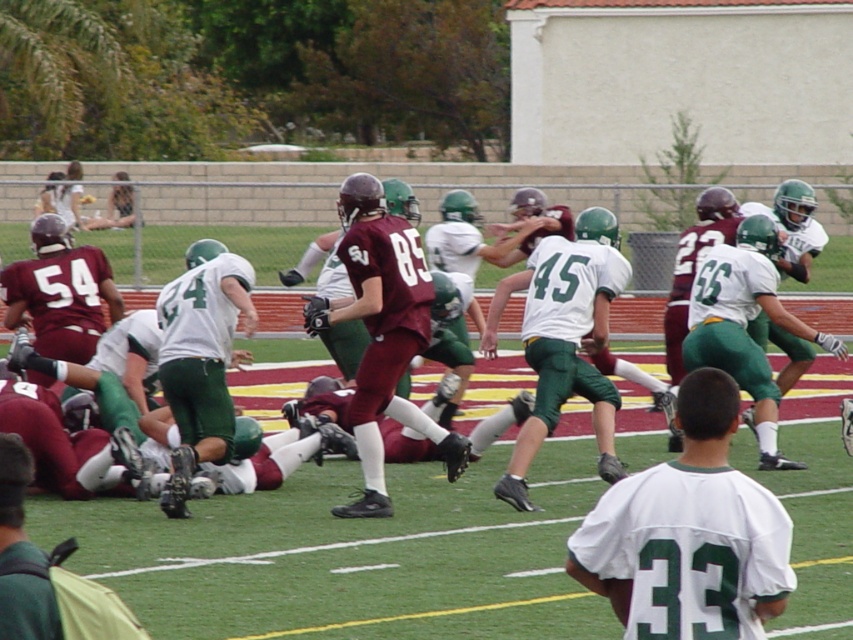
Measure the distance between white jersey at center and camera.

A distance of 43.03 feet exists between white jersey at center and camera.

From the picture: Does white jersey at center have a lesser width compared to green fabric backpack at lower left?

No, white jersey at center is not thinner than green fabric backpack at lower left.

Where is `white jersey at center`? white jersey at center is located at coordinates (746, 324).

Between point (160, 317) and point (744, 369), which one is positioned behind?

Positioned behind is point (744, 369).

This screenshot has width=853, height=640. Describe the element at coordinates (379, 316) in the screenshot. I see `maroon jersey at center` at that location.

You are a GUI agent. You are given a task and a screenshot of the screen. Output one action in this format:
    pyautogui.click(x=<x>, y=<y>)
    Task: Click on the maroon jersey at center
    This screenshot has height=640, width=853.
    Given the screenshot: What is the action you would take?
    (x=379, y=316)

Does point (780, 561) come behind point (416, 243)?

No, it is in front of (416, 243).

Does white matte jersey at center appear under maroon uniform at center?

Correct, white matte jersey at center is located below maroon uniform at center.

Is point (683, 472) in front of point (364, 476)?

Yes, it is in front of point (364, 476).

The height and width of the screenshot is (640, 853). I want to click on white matte jersey at center, so click(x=689, y=534).